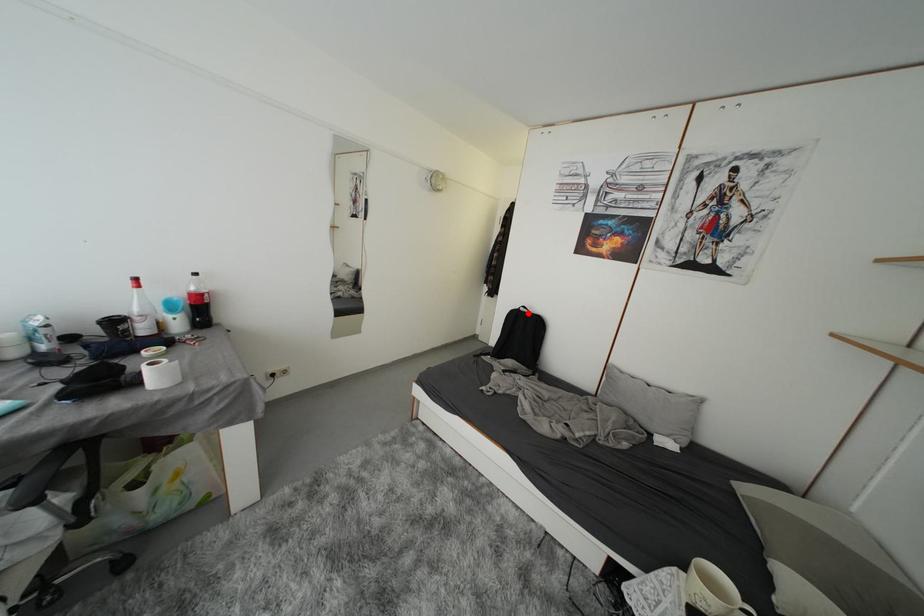
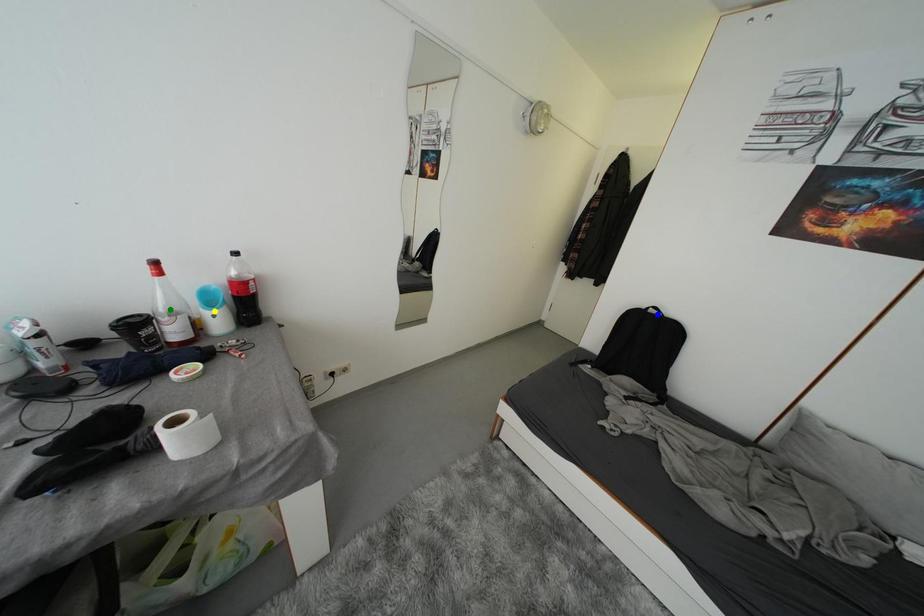
Question: I am providing you with two images of the same scene from different viewpoints. A red point is marked on the first image. You are given multiple points on the second image. Which point in image 2 represents the same 3d spot as the red point in image 1?

Choices:
 (A) yellow point
 (B) green point
 (C) blue point

Answer: (C)